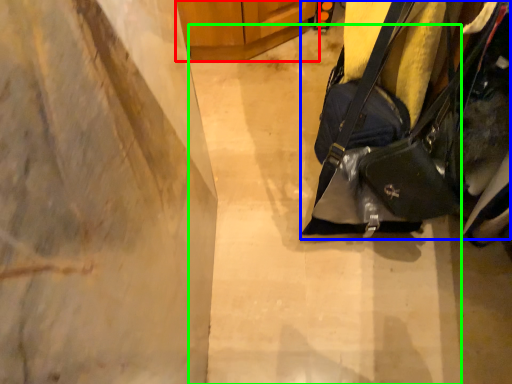
Question: Estimate the real-world distances between objects in this image. Which object is farther from furniture (highlighted by a red box), handbag (highlighted by a blue box) or concrete (highlighted by a green box)?

Choices:
 (A) handbag
 (B) concrete

Answer: (A)